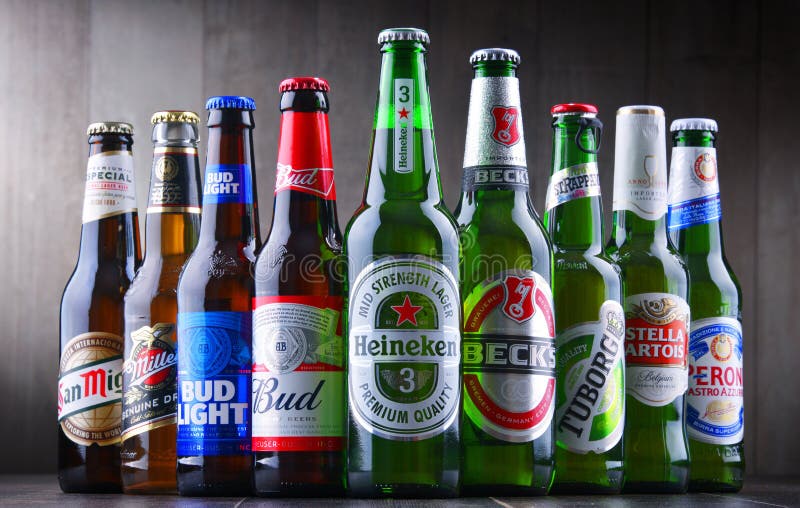
Find the location of a particular element. beer bottles is located at coordinates (706, 278), (650, 270), (588, 271), (516, 280), (420, 278), (326, 306), (210, 333), (154, 338), (86, 338).